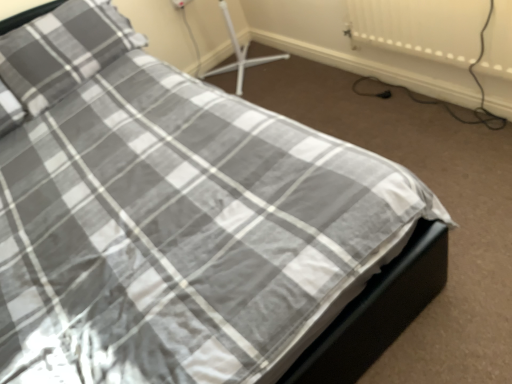
Question: Does plaid fabric pillow at upper left appear on the right side of white textured radiator at upper right?

Choices:
 (A) yes
 (B) no

Answer: (B)

Question: Considering the relative sizes of plaid fabric pillow at upper left and white textured radiator at upper right in the image provided, is plaid fabric pillow at upper left taller than white textured radiator at upper right?

Choices:
 (A) yes
 (B) no

Answer: (A)

Question: Does plaid fabric pillow at upper left contain white textured radiator at upper right?

Choices:
 (A) yes
 (B) no

Answer: (B)

Question: Can you confirm if plaid fabric pillow at upper left is thinner than white textured radiator at upper right?

Choices:
 (A) no
 (B) yes

Answer: (A)

Question: Is plaid fabric pillow at upper left closer to the viewer compared to white textured radiator at upper right?

Choices:
 (A) yes
 (B) no

Answer: (B)

Question: Considering the relative sizes of plaid fabric pillow at upper left and white textured radiator at upper right in the image provided, is plaid fabric pillow at upper left smaller than white textured radiator at upper right?

Choices:
 (A) yes
 (B) no

Answer: (B)

Question: Is white textured radiator at upper right aimed at plaid fabric pillow at upper left?

Choices:
 (A) yes
 (B) no

Answer: (B)

Question: Is white textured radiator at upper right thinner than plaid fabric pillow at upper left?

Choices:
 (A) no
 (B) yes

Answer: (B)

Question: From the image's perspective, would you say white textured radiator at upper right is shown under plaid fabric pillow at upper left?

Choices:
 (A) no
 (B) yes

Answer: (B)

Question: Does white textured radiator at upper right have a greater width compared to plaid fabric pillow at upper left?

Choices:
 (A) no
 (B) yes

Answer: (A)

Question: Does white textured radiator at upper right have a lesser height compared to plaid fabric pillow at upper left?

Choices:
 (A) yes
 (B) no

Answer: (A)

Question: Does white textured radiator at upper right have a larger size compared to plaid fabric pillow at upper left?

Choices:
 (A) no
 (B) yes

Answer: (A)

Question: From the image's perspective, relative to white textured radiator at upper right, is plaid fabric pillow at upper left above or below?

Choices:
 (A) below
 (B) above

Answer: (B)